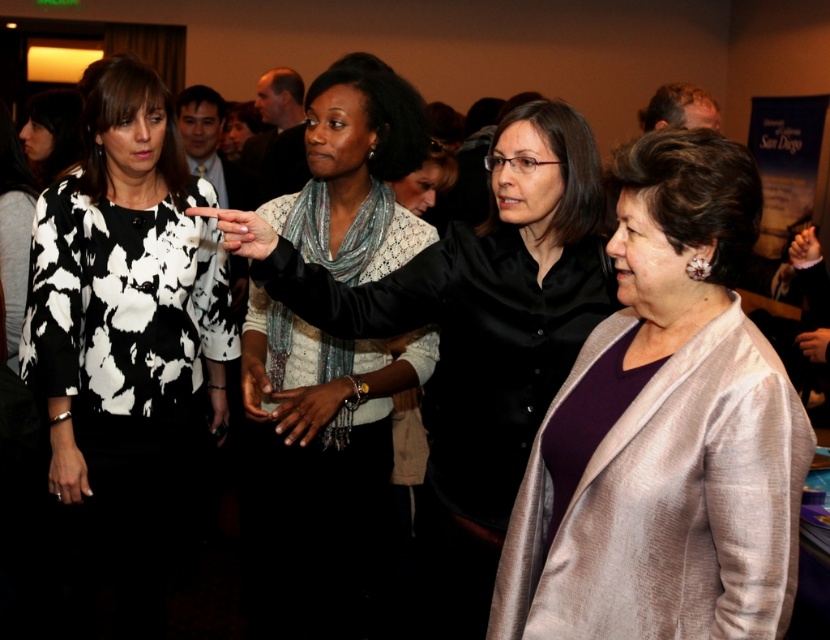
What is the purpose of the point marked at coordinates (x=127, y=326) in the image?

The point marked at coordinates (x=127, y=326) marks the location of the black and white printed blouse at left.

You are attending a formal event and need to decide which clothing item to wear. You have a silky beige coat at center and a white lace blouse at center. Based on their lengths, which one should you choose if you want something that covers more of your body?

The white lace blouse at center is longer than the silky beige coat at center, so if you want something that covers more of your body, you should choose the white lace blouse at center.

You are attending a presentation at UC San Diego and notice two clothing items at the center of the image. Which clothing item is closer to you, the silky beige coat at center or the white lace blouse at center?

The silky beige coat at center is closer to you because it is in front of the white lace blouse at center.